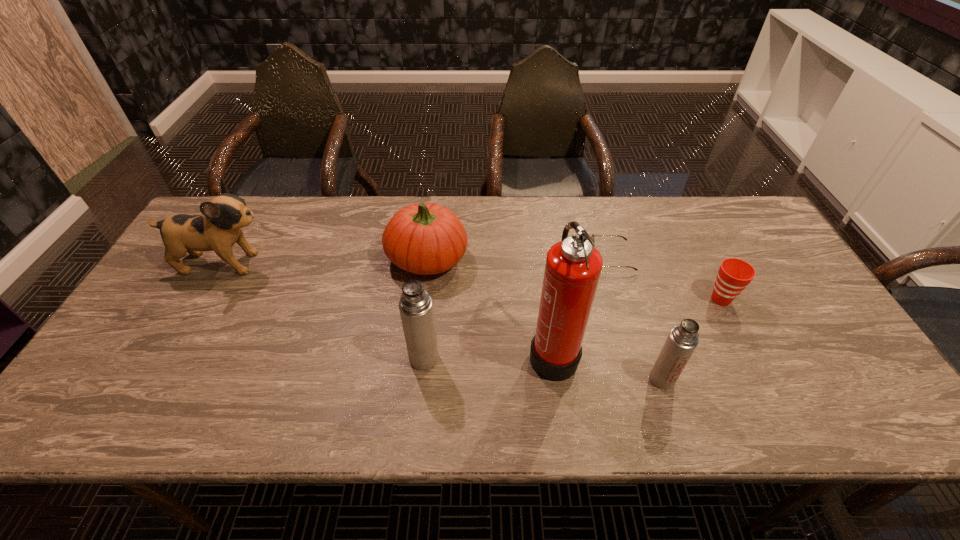
The width and height of the screenshot is (960, 540). I want to click on vacant area between the pumpkin and the sunglasses, so click(x=519, y=258).

The height and width of the screenshot is (540, 960). I want to click on vacant point located between the fire extinguisher and the puppy, so click(388, 308).

At what (x,y) coordinates should I click in order to perform the action: click on vacant area that lies between the left thermos bottle and the fire extinguisher. Please return your answer as a coordinate pair (x, y). Image resolution: width=960 pixels, height=540 pixels. Looking at the image, I should click on (489, 355).

This screenshot has height=540, width=960. In order to click on empty space that is in between the shortest object and the fourth nearest object in this screenshot , I will do `click(666, 279)`.

Locate an element on the screen. vacant area that lies between the right thermos bottle and the leftmost object is located at coordinates (443, 321).

The height and width of the screenshot is (540, 960). Identify the location of vacant point located between the shortest object and the taller thermos bottle. (517, 308).

Point out which object is positioned as the fourth nearest to the taller thermos bottle. Please provide its 2D coordinates. Your answer should be formatted as a tuple, i.e. [(x, y)], where the tuple contains the x and y coordinates of a point satisfying the conditions above.

[(682, 340)]

This screenshot has height=540, width=960. In order to click on object that stands as the second closest to the pumpkin in this screenshot , I will do `click(416, 309)`.

This screenshot has width=960, height=540. I want to click on vacant region that satisfies the following two spatial constraints: 1. on the back side of the fourth farthest object; 2. on the lenses of the shortest object, so click(700, 258).

This screenshot has height=540, width=960. Find the location of `free spot that satisfies the following two spatial constraints: 1. at the face of the rightmost object; 2. on the right side of the leftmost object`. free spot that satisfies the following two spatial constraints: 1. at the face of the rightmost object; 2. on the right side of the leftmost object is located at coordinates (203, 299).